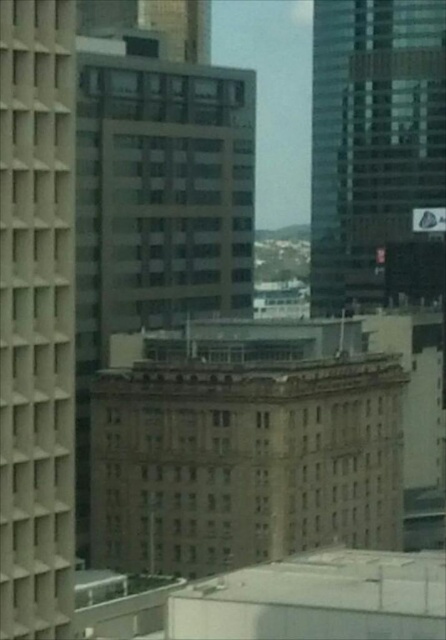
You are a city planner assessing the spacing between the brown stone building at center and the beige concrete building at left. According to the city regulations, the minimum required distance between two buildings of this type is 300 feet. Does the current spacing meet the requirement?

The distance between the brown stone building at center and the beige concrete building at left is 291.56 feet, which is less than the required 300 feet. Therefore, the current spacing does not meet the city regulations.

You are a city planner reviewing the city layout. You need to determine the location of the brown stone building at center relative to the other buildings. Based on its coordinates, where would you find it in the city map?

The brown stone building at center is located at coordinates point (240, 474), which places it centrally within the city map.